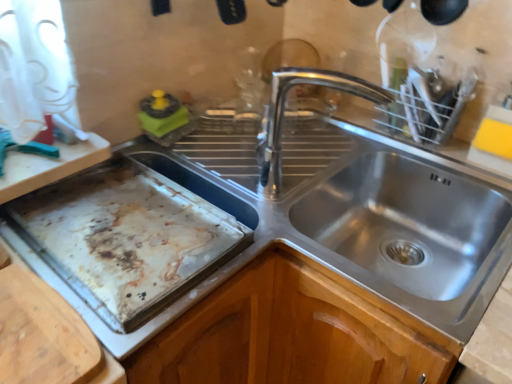
Question: Is stainless steel sink at center far away from stained aluminum baking sheet at left?

Choices:
 (A) yes
 (B) no

Answer: (B)

Question: Is stainless steel sink at center aimed at stained aluminum baking sheet at left?

Choices:
 (A) yes
 (B) no

Answer: (B)

Question: Does stainless steel sink at center have a smaller size compared to stained aluminum baking sheet at left?

Choices:
 (A) no
 (B) yes

Answer: (A)

Question: Is stainless steel sink at center closer to camera compared to stained aluminum baking sheet at left?

Choices:
 (A) no
 (B) yes

Answer: (B)

Question: Does stainless steel sink at center have a lesser width compared to stained aluminum baking sheet at left?

Choices:
 (A) yes
 (B) no

Answer: (B)

Question: Can you confirm if stainless steel sink at center is wider than stained aluminum baking sheet at left?

Choices:
 (A) yes
 (B) no

Answer: (A)

Question: Is stainless steel sink at center behind polished metal tap at center?

Choices:
 (A) yes
 (B) no

Answer: (B)

Question: Is stainless steel sink at center next to polished metal tap at center?

Choices:
 (A) no
 (B) yes

Answer: (A)

Question: Would you say stainless steel sink at center is outside polished metal tap at center?

Choices:
 (A) yes
 (B) no

Answer: (A)

Question: Does stainless steel sink at center contain polished metal tap at center?

Choices:
 (A) yes
 (B) no

Answer: (B)

Question: Can you confirm if stainless steel sink at center is taller than polished metal tap at center?

Choices:
 (A) no
 (B) yes

Answer: (B)

Question: Is stainless steel sink at center smaller than polished metal tap at center?

Choices:
 (A) no
 (B) yes

Answer: (A)

Question: Is stained aluminum baking sheet at left outside stainless steel sink at center?

Choices:
 (A) yes
 (B) no

Answer: (A)